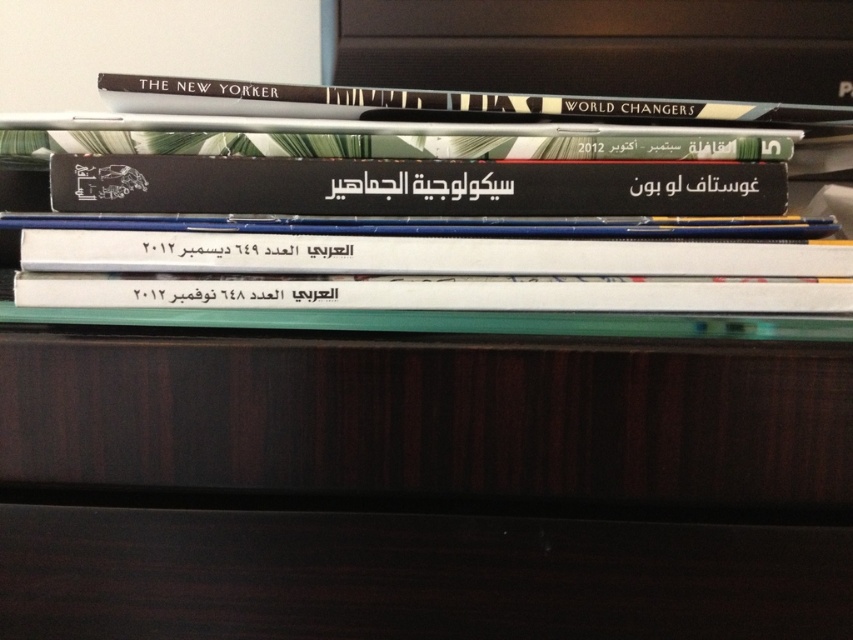
The width and height of the screenshot is (853, 640). What are the coordinates of `black matte book at center` in the screenshot? It's located at (413, 186).

Between black matte book at center and white paper at center, which one is positioned higher?

Positioned higher is black matte book at center.

You are a GUI agent. You are given a task and a screenshot of the screen. Output one action in this format:
    pyautogui.click(x=<x>, y=<y>)
    Task: Click on the black matte book at center
    
    Given the screenshot: What is the action you would take?
    click(x=413, y=186)

This screenshot has height=640, width=853. I want to click on black matte book at center, so click(413, 186).

Which of these two, white paper at center or hardcover book at upper center, stands shorter?

white paper at center

Is white paper at center behind hardcover book at upper center?

No, it is in front of hardcover book at upper center.

The width and height of the screenshot is (853, 640). What do you see at coordinates (439, 292) in the screenshot? I see `white paper at center` at bounding box center [439, 292].

I want to click on white paper at center, so click(439, 292).

Is point (184, 262) in front of point (285, 84)?

Yes, it is.

Is white paper book at center behind hardcover book at upper center?

No, it is in front of hardcover book at upper center.

Find the location of `white paper book at center`. white paper book at center is located at coordinates (421, 253).